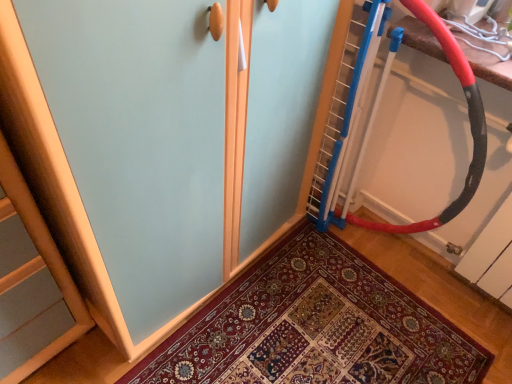
Question: Is red rubber garden hose at right situated inside patterned carpet at center or outside?

Choices:
 (A) inside
 (B) outside

Answer: (B)

Question: Does point (480, 109) appear closer or farther from the camera than point (330, 288)?

Choices:
 (A) closer
 (B) farther

Answer: (A)

Question: Considering the relative positions of red rubber garden hose at right and patterned carpet at center in the image provided, is red rubber garden hose at right to the left or to the right of patterned carpet at center?

Choices:
 (A) right
 (B) left

Answer: (A)

Question: Choose the correct answer: Is patterned carpet at center inside red rubber garden hose at right or outside it?

Choices:
 (A) inside
 (B) outside

Answer: (B)

Question: Is patterned carpet at center bigger or smaller than red rubber garden hose at right?

Choices:
 (A) big
 (B) small

Answer: (B)

Question: From the image's perspective, is patterned carpet at center above or below red rubber garden hose at right?

Choices:
 (A) below
 (B) above

Answer: (A)

Question: In terms of width, does patterned carpet at center look wider or thinner when compared to red rubber garden hose at right?

Choices:
 (A) thin
 (B) wide

Answer: (B)